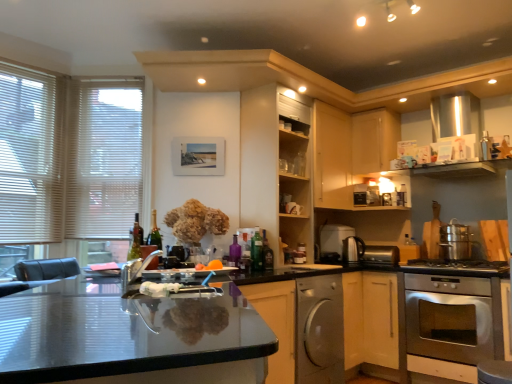
Identify the location of empty space that is ontop of white plastic blinds at left (from a real-world perspective). This screenshot has height=384, width=512. (111, 81).